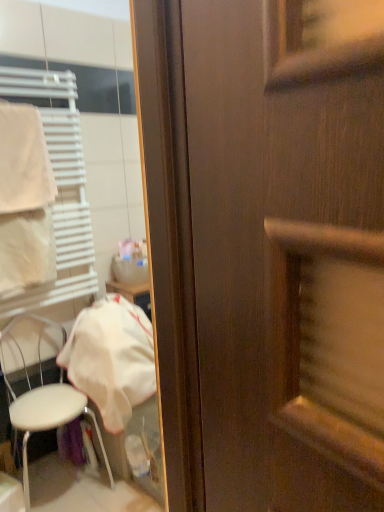
Question: Visually, is white plastic towel rack at left positioned to the left or to the right of white fabric at left?

Choices:
 (A) right
 (B) left

Answer: (B)

Question: From the image's perspective, is white plastic towel rack at left above or below white fabric at left?

Choices:
 (A) below
 (B) above

Answer: (B)

Question: Which object is positioned closest to the white plastic towel rack at left?

Choices:
 (A) white plastic chair at lower left
 (B) white fabric at left
 (C) white fabric towel at left

Answer: (C)

Question: Which object is the farthest from the white fabric at left?

Choices:
 (A) white plastic chair at lower left
 (B) white fabric towel at left
 (C) white plastic towel rack at left

Answer: (B)